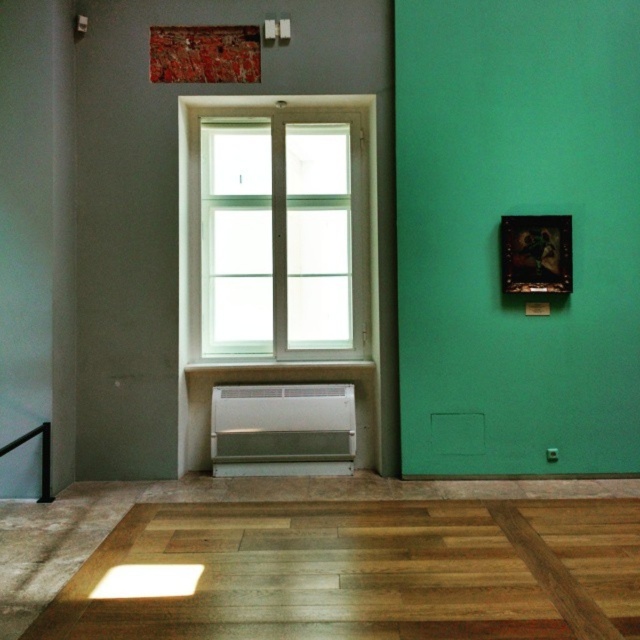
Question: Can you confirm if light brown wood flooring at center is positioned to the left of white glass window at center?

Choices:
 (A) yes
 (B) no

Answer: (B)

Question: Is light brown wood flooring at center positioned in front of white glass window at center?

Choices:
 (A) yes
 (B) no

Answer: (A)

Question: Estimate the real-world distances between objects in this image. Which object is farther from the white plastic radiator at center?

Choices:
 (A) white glass window at center
 (B) light brown wood flooring at center
 (C) black metal balustrade at lower left

Answer: (C)

Question: Which object is farther from the camera taking this photo?

Choices:
 (A) white plastic radiator at center
 (B) white glass window at center

Answer: (B)

Question: Which of these objects is positioned closest to the black metal balustrade at lower left?

Choices:
 (A) white glass window at center
 (B) white plastic radiator at center

Answer: (B)

Question: Does white glass window at center have a smaller size compared to white plastic radiator at center?

Choices:
 (A) yes
 (B) no

Answer: (B)